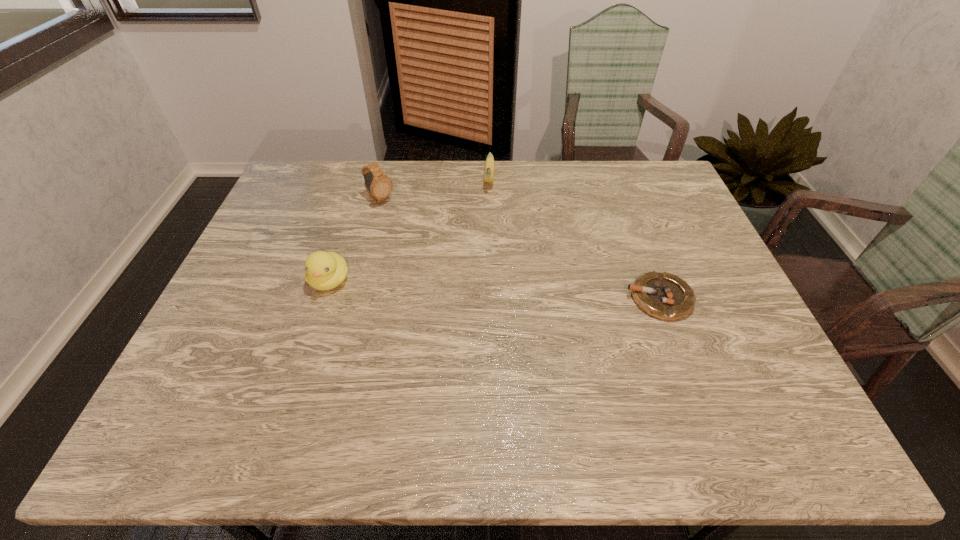
You are a GUI agent. You are given a task and a screenshot of the screen. Output one action in this format:
    pyautogui.click(x=<x>, y=<y>)
    Task: Click on the vacant space on the desktop that is between the duckling and the rightmost object and is positioned on the face of the watch
    This screenshot has height=540, width=960.
    Given the screenshot: What is the action you would take?
    pyautogui.click(x=498, y=289)

Locate an element on the screen. free space on the desktop that is between the duckling and the shortest object and is positioned at the stem of the second object from right to left is located at coordinates (483, 289).